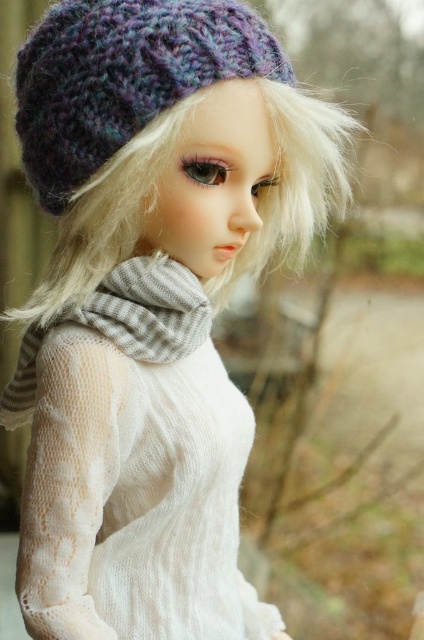
You are a photographer adjusting the focus on your camera. You notice the point at coordinates (x=123, y=76) on the image. Based on the scene description, what object is located at this point?

The point at coordinates (x=123, y=76) indicates the purple knitted hat at upper center.

You are a fashion designer who wants to create a winter outfit for a doll. You have the white knitted dress at center and the purple knitted hat at upper center. Which item should you choose to emphasize verticality in the outfit?

The white knitted dress at center is much taller than the purple knitted hat at upper center, so choosing the white knitted dress at center would better emphasize verticality in the outfit.

You are a photographer trying to capture the doll in the image. You want to place a decorative frame around the white knitted dress at center located at point (133, 468). What is the exact coordinate where you should position the frame?

The exact coordinate to position the frame around the white knitted dress at center is point (133, 468).